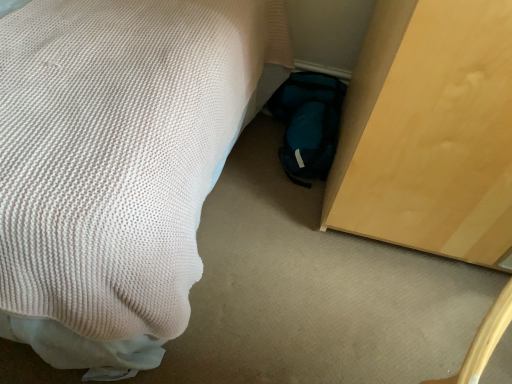
The width and height of the screenshot is (512, 384). I want to click on free region on the left part of teal fabric bag at lower center, so click(254, 155).